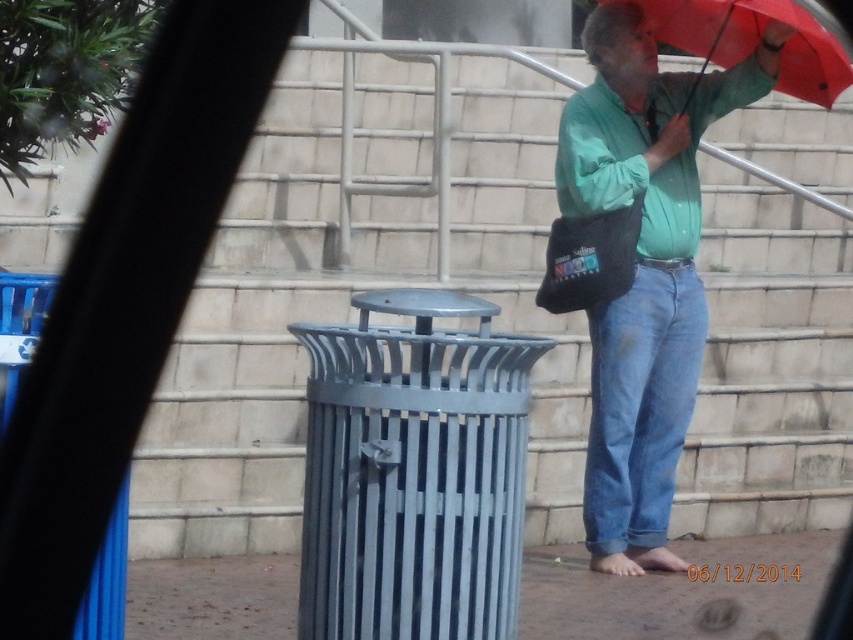
Question: Estimate the real-world distances between objects in this image. Which object is closer to the gray concrete stairs at center?

Choices:
 (A) green matte shirt at upper right
 (B) red matte umbrella at upper right

Answer: (A)

Question: Does gray concrete stairs at center appear under red matte umbrella at upper right?

Choices:
 (A) yes
 (B) no

Answer: (A)

Question: Is gray concrete stairs at center wider than red matte umbrella at upper right?

Choices:
 (A) yes
 (B) no

Answer: (A)

Question: Does gray concrete stairs at center appear over red matte umbrella at upper right?

Choices:
 (A) yes
 (B) no

Answer: (B)

Question: Which point is closer to the camera taking this photo?

Choices:
 (A) (738, 13)
 (B) (601, 394)

Answer: (B)

Question: Which point appears closest to the camera in this image?

Choices:
 (A) (585, 461)
 (B) (439, 44)
 (C) (827, 54)

Answer: (C)